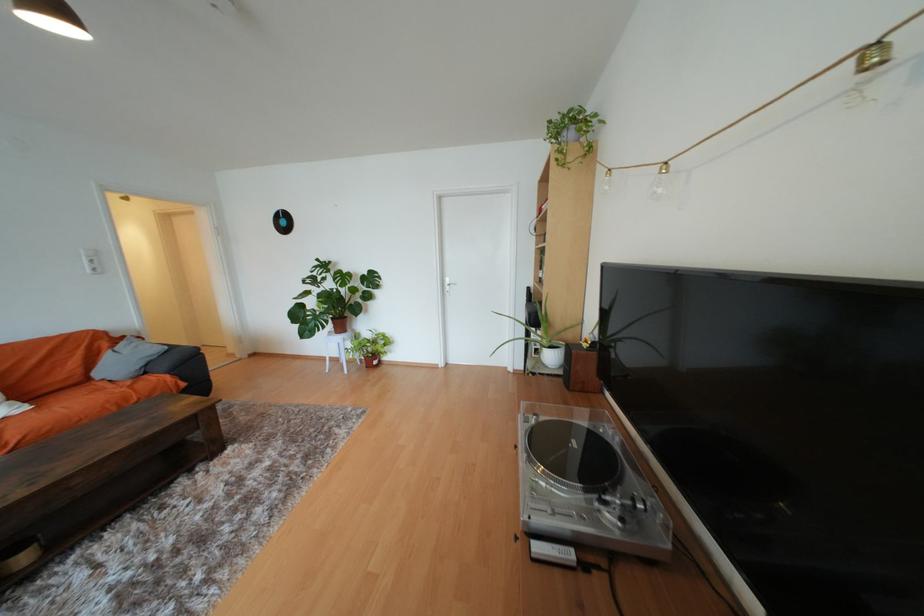
Locate an element on the screen. The width and height of the screenshot is (924, 616). black sofa armrest is located at coordinates (180, 355).